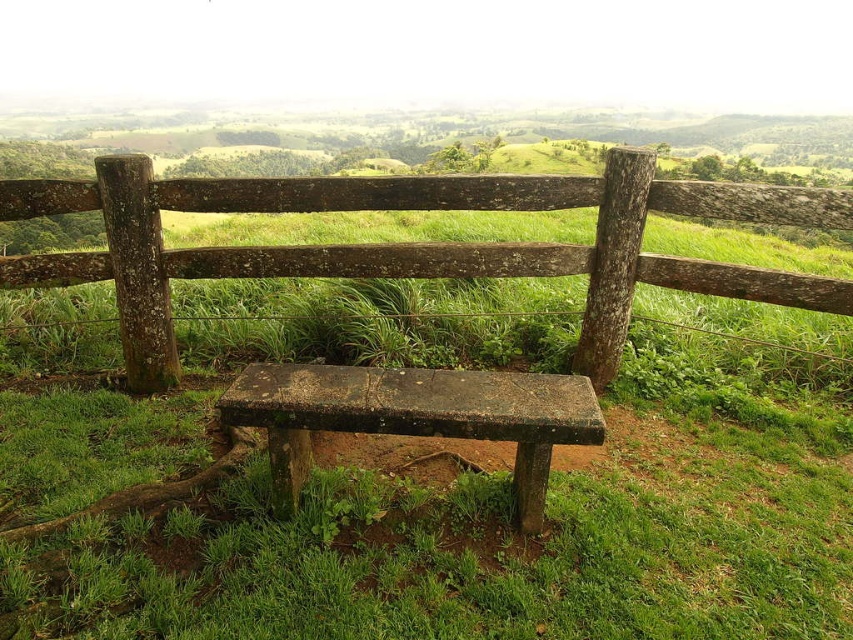
You are standing at the center of the image and want to walk towards the weathered wood fence at center. In which direction should you move?

You should move towards the center of the image, as the weathered wood fence at center is located at point [412,243].

You are designing a garden layout and need to place a new flower pot between the weathered wood fence at center and the rusty concrete bench at center. Which object should the flower pot be closer to if you want it to be proportionally balanced with their sizes?

The flower pot should be closer to the rusty concrete bench at center because the weathered wood fence at center is larger in size, so placing the flower pot closer to the smaller object maintains proportional balance.